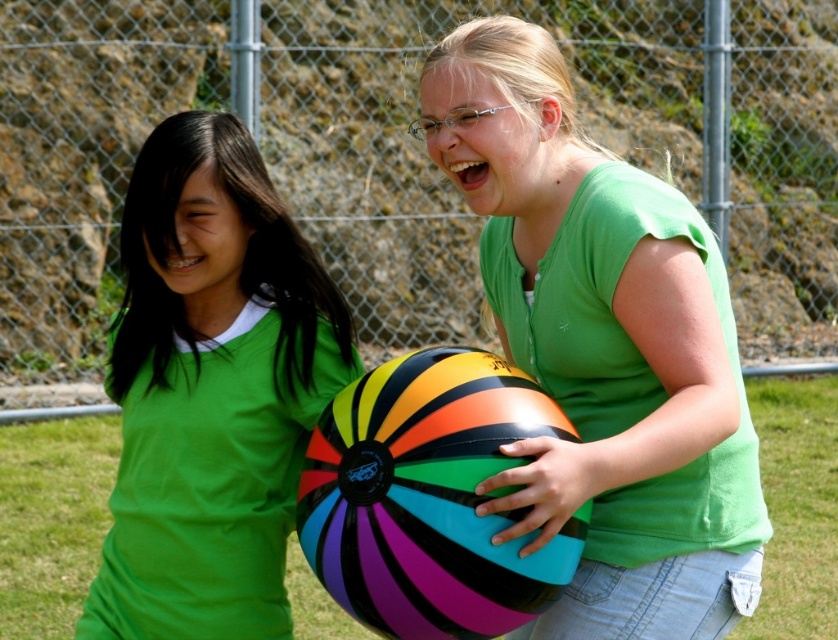
You are standing at the point labeled as point (210, 390). Which object from the scene is directly under your feet?

The point (210, 390) is on green matte shirt at center, so the object directly under your feet is the green matte shirt at center.

In the scene shown: You are standing in front of the two people and want to take a photo of them. Which of the two points, point (652, 540) or point (388, 586), will appear closer to the camera in the photo?

Point (388, 586) will appear closer to the camera in the photo because it is closer to the viewer than point (652, 540), which is further away.